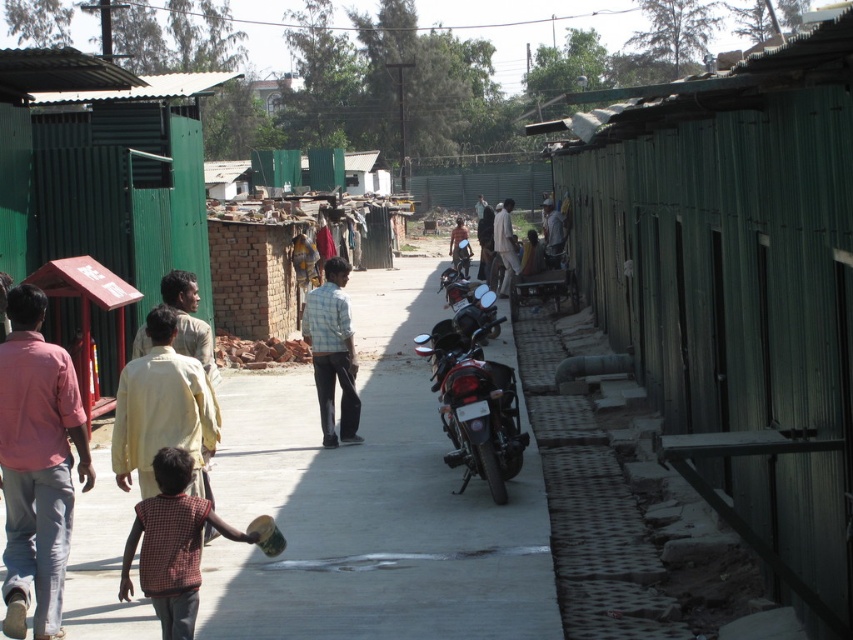
Who is lower down, light yellow fabric shirt at center-left or shiny metallic motorcycle at center?

light yellow fabric shirt at center-left is lower down.

Is light yellow fabric shirt at center-left taller than shiny metallic motorcycle at center?

Yes, light yellow fabric shirt at center-left is taller than shiny metallic motorcycle at center.

Between point (142, 492) and point (496, 362), which one is positioned behind?

The point (496, 362) is behind.

Locate an element on the screen. light yellow fabric shirt at center-left is located at coordinates (161, 410).

Is light blue checkered shirt at center bigger than light beige fabric shirt at center?

No, light blue checkered shirt at center is not bigger than light beige fabric shirt at center.

In the scene shown: Is light blue checkered shirt at center wider than light beige fabric shirt at center?

Yes.

Locate an element on the screen. The image size is (853, 640). light blue checkered shirt at center is located at coordinates (332, 353).

Can you confirm if gray concrete pavement at center is smaller than checkered fabric shirt at lower left?

No, gray concrete pavement at center is not smaller than checkered fabric shirt at lower left.

Which is below, gray concrete pavement at center or checkered fabric shirt at lower left?

checkered fabric shirt at lower left is below.

Between point (369, 333) and point (213, 520), which one is positioned in front?

Positioned in front is point (213, 520).

This screenshot has height=640, width=853. In order to click on gray concrete pavement at center in this screenshot , I will do `click(370, 502)`.